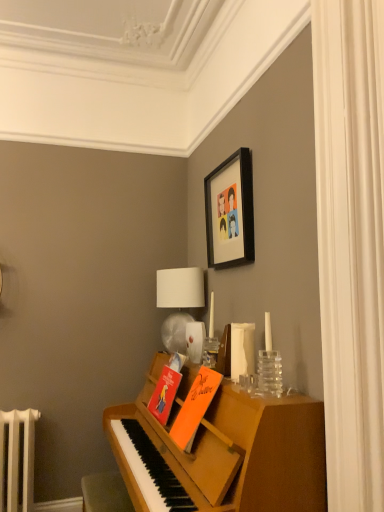
Question: Do you think matte orange book at center, acting as the first book starting from the back, is within white fabric curtain at right, or outside of it?

Choices:
 (A) inside
 (B) outside

Answer: (B)

Question: In the image, is matte orange book at center, which is the second book in front-to-back order, positioned in front of or behind white fabric curtain at right?

Choices:
 (A) front
 (B) behind

Answer: (B)

Question: Which of these objects is positioned closest to the white fabric curtain at right?

Choices:
 (A) orange matte book at center, the 1th book from the front
 (B) white fabric lampshade at upper center
 (C) clear glass vase at right
 (D) matte orange book at center, acting as the first book starting from the back
 (E) black matte picture frame at upper center

Answer: (C)

Question: Which object is the closest to the white fabric lampshade at upper center?

Choices:
 (A) clear glass vase at right
 (B) orange matte book at center, the 1th book from the front
 (C) white fabric curtain at right
 (D) matte orange book at center, acting as the first book starting from the back
 (E) black matte picture frame at upper center

Answer: (E)